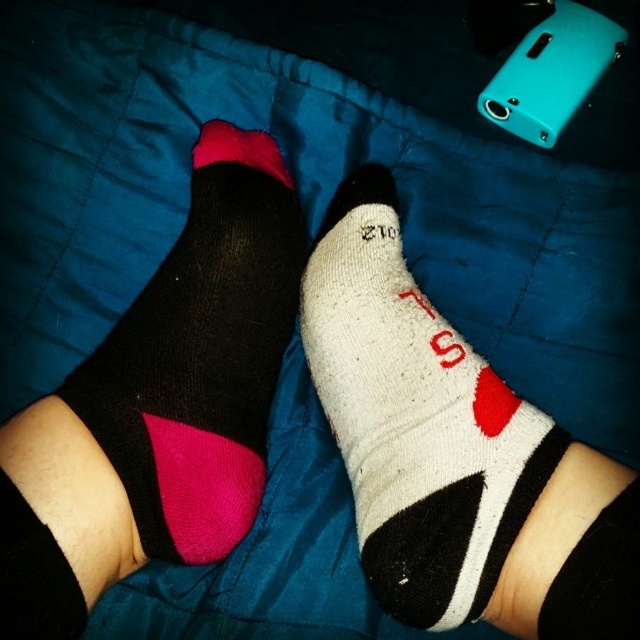
Question: Is white cotton sock at center smaller than matte black sock at left?

Choices:
 (A) yes
 (B) no

Answer: (B)

Question: Which of the following is the farthest from the observer?

Choices:
 (A) (528, 476)
 (B) (193, 481)

Answer: (B)

Question: From the image, what is the correct spatial relationship of white cotton sock at center in relation to matte black sock at left?

Choices:
 (A) below
 (B) above

Answer: (A)

Question: Which point is closer to the camera?

Choices:
 (A) (195, 416)
 (B) (356, 520)

Answer: (A)

Question: In this image, where is white cotton sock at center located relative to matte black sock at left?

Choices:
 (A) left
 (B) right

Answer: (B)